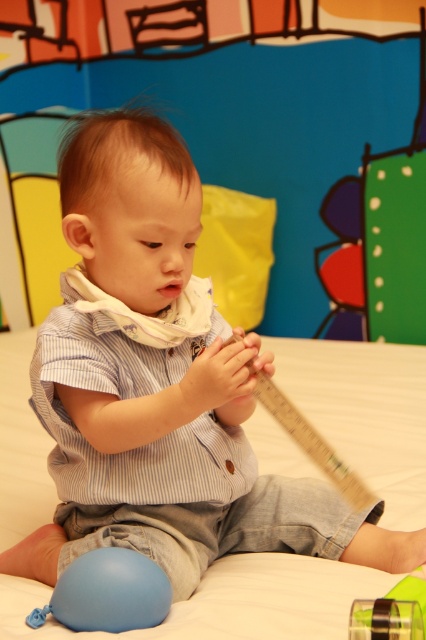
In order to click on blue rubber balloon at lower left in this screenshot , I will do `click(108, 593)`.

Is point (75, 618) positioned behind point (397, 627)?

Yes, point (75, 618) is behind point (397, 627).

Who is more distant from viewer, (112, 564) or (365, 620)?

Point (112, 564)

Locate an element on the screen. The image size is (426, 640). blue rubber balloon at lower left is located at coordinates (108, 593).

Can you confirm if blue rubber balloon at lower left is shorter than wooden ruler at center?

Correct, blue rubber balloon at lower left is not as tall as wooden ruler at center.

Does blue rubber balloon at lower left appear on the left side of wooden ruler at center?

Indeed, blue rubber balloon at lower left is positioned on the left side of wooden ruler at center.

Does point (138, 618) come in front of point (273, 403)?

Yes.

Identify the location of blue rubber balloon at lower left. This screenshot has height=640, width=426. (108, 593).

Does wooden ruler at center have a smaller size compared to transparent plastic tape at lower right?

Actually, wooden ruler at center might be larger than transparent plastic tape at lower right.

Is wooden ruler at center bigger than transparent plastic tape at lower right?

Yes.

Is point (268, 378) closer to camera compared to point (354, 616)?

No, it is behind (354, 616).

Image resolution: width=426 pixels, height=640 pixels. Find the location of `wooden ruler at center`. wooden ruler at center is located at coordinates (310, 442).